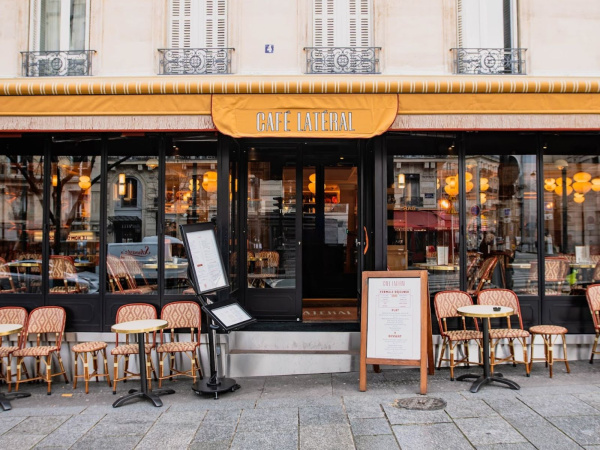
Locate an element on the screen. This screenshot has height=450, width=600. tall windows is located at coordinates (50, 235), (125, 233), (180, 222), (416, 223), (493, 218), (578, 218).